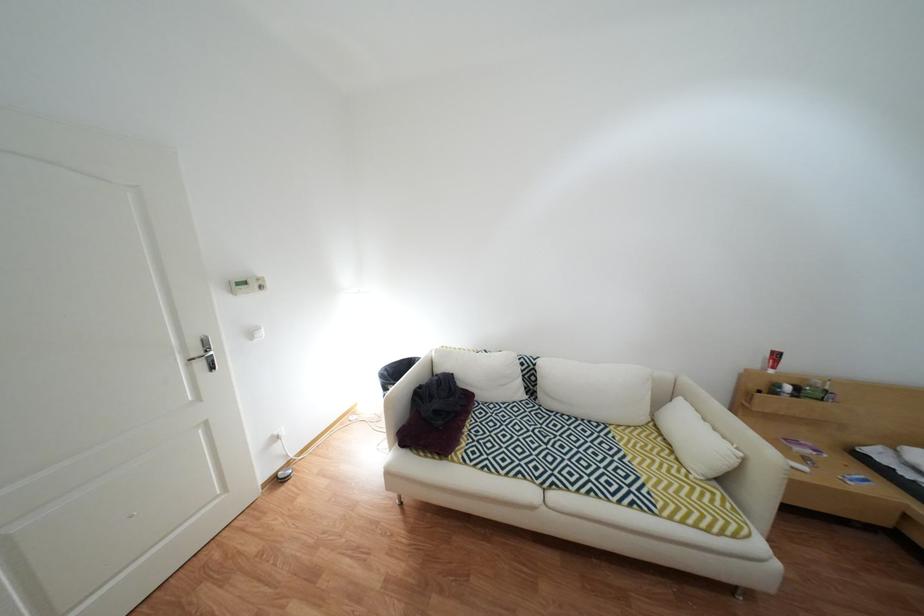
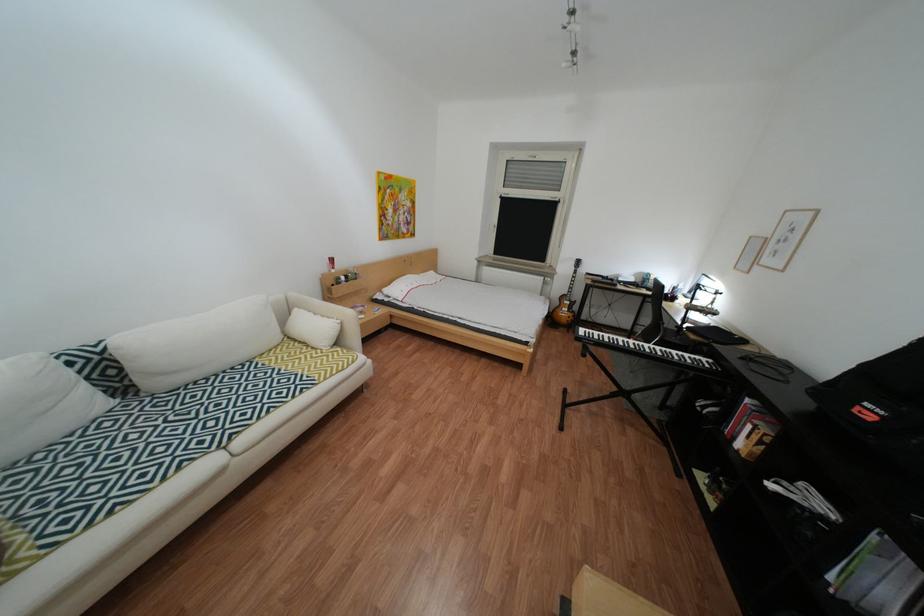
Locate, in the second image, the point that corresponds to the point at 676,436 in the first image.

(311, 342)